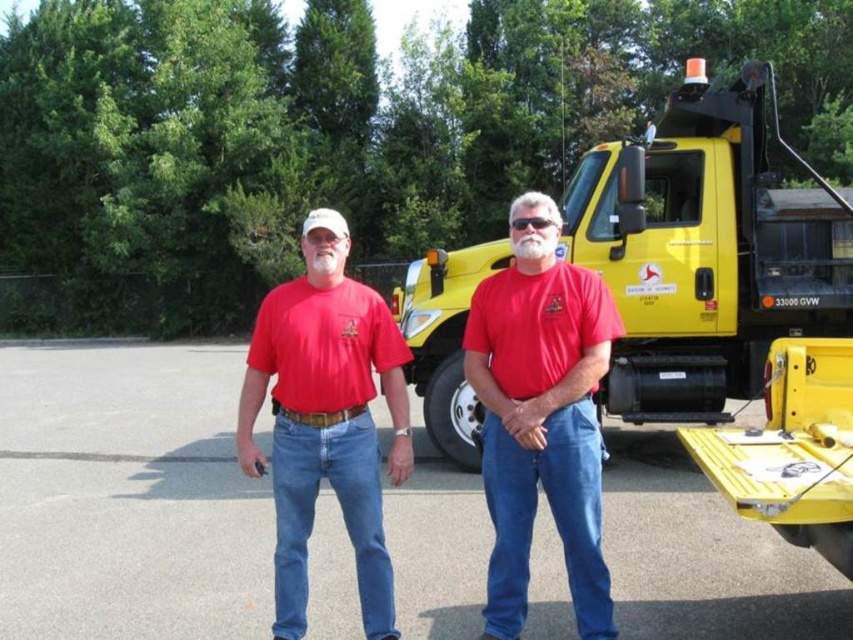
You are standing at the center of the paved area and want to move to the yellow matte tow truck at right. According to the coordinates provided, in which direction should you walk?

The yellow matte tow truck at right is located at coordinates point (x=706, y=250). Since you are at the center, you should walk towards the right side to reach it.

You are a photographer trying to capture both the gray asphalt parking lot at center and the red cotton shirt at center in a single frame. Based on their widths, which object should you prioritize positioning closer to the camera to ensure it appears larger in the photo?

The gray asphalt parking lot at center is wider than the red cotton shirt at center, so positioning the gray asphalt parking lot at center closer to the camera will make it appear larger in the photo.